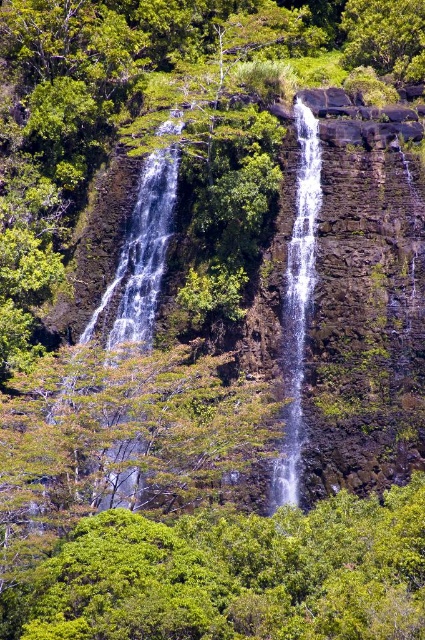
You are standing at the edge of the cliff overlooking the waterfall. You see the white frothy water at center. Can you determine its exact location in the scene?

The white frothy water at center is located at point [141,256].

You are a hiker standing at the edge of the waterfall. You notice two distinct areas of water in the center of the waterfall. The first is white frothy water at center, and the second is clear water at center. Which one is farther away from you?

The white frothy water at center is 10.73 meters from clear water at center, so the white frothy water at center is farther away from you than the clear water at center.

You are a hiker standing at the edge of the forest looking at the green leafy tree at center and the white frothy water at center. Which object is shorter?

The green leafy tree at center is shorter than the white frothy water at center.